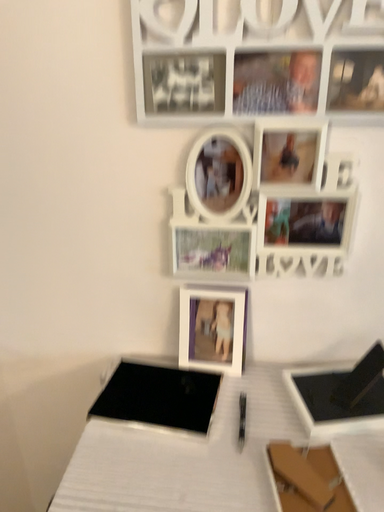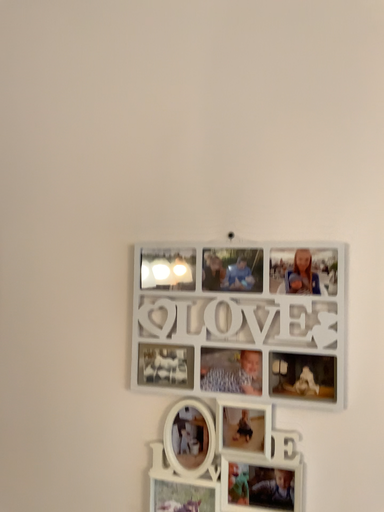
Question: Which way did the camera rotate in the video?

Choices:
 (A) rotated upward
 (B) rotated downward

Answer: (A)